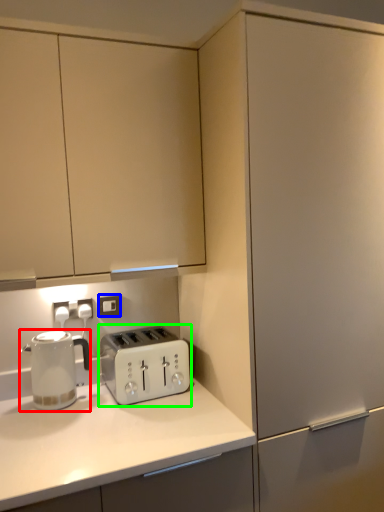
Question: Considering the real-world distances, which object is farthest from home appliance (highlighted by a red box)? electric outlet (highlighted by a blue box) or toaster (highlighted by a green box)?

Choices:
 (A) electric outlet
 (B) toaster

Answer: (A)